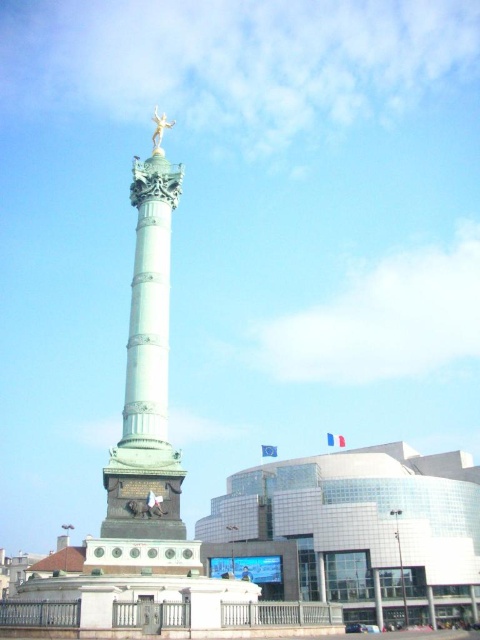
Question: Observing the image, what is the correct spatial positioning of bronze/golden column at center in reference to gold/gilded metal statue at upper center?

Choices:
 (A) above
 (B) below

Answer: (B)

Question: Which point is closer to the camera?

Choices:
 (A) (156, 129)
 (B) (171, 509)

Answer: (B)

Question: Does bronze/golden column at center appear on the left side of gold/gilded metal statue at upper center?

Choices:
 (A) yes
 (B) no

Answer: (B)

Question: Can you confirm if bronze/golden column at center is smaller than gold/gilded metal statue at upper center?

Choices:
 (A) yes
 (B) no

Answer: (A)